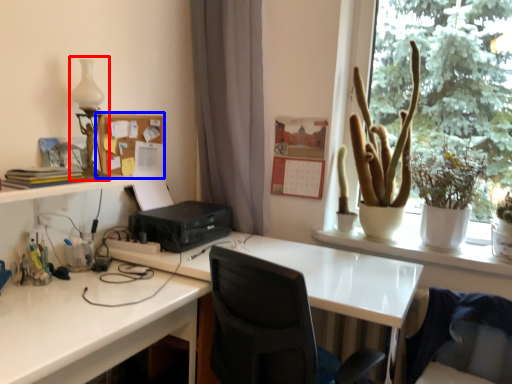
Question: Which point is further to the camera, table lamp (highlighted by a red box) or bulletin board (highlighted by a blue box)?

Choices:
 (A) table lamp
 (B) bulletin board

Answer: (B)